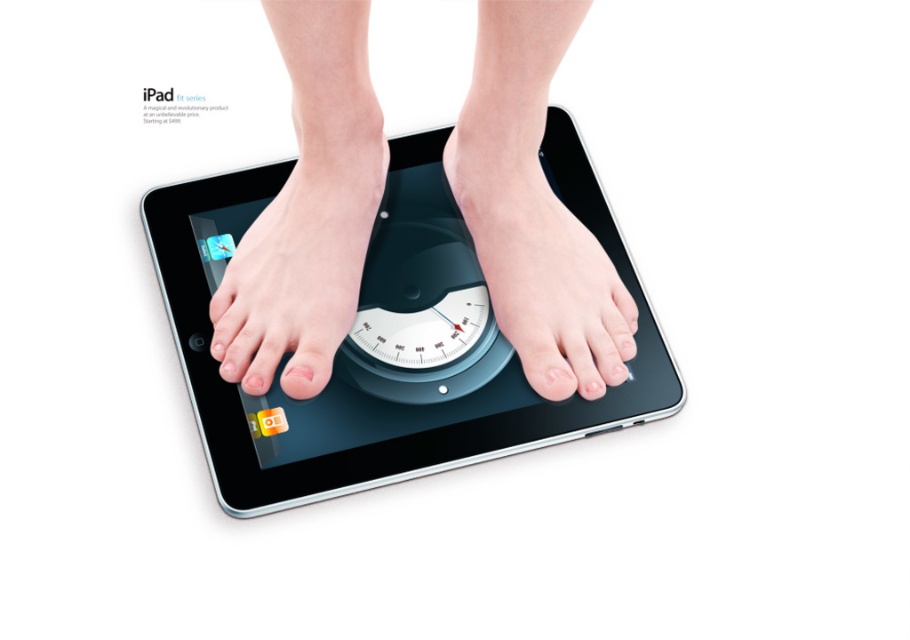
What do you see at coordinates (375, 358) in the screenshot?
I see `black glossy tablet at center` at bounding box center [375, 358].

Is point (638, 317) more distant than point (364, 232)?

Yes, it is.

This screenshot has width=910, height=640. Find the location of `black glossy tablet at center`. black glossy tablet at center is located at coordinates (375, 358).

Is point (514, 68) behind point (550, 285)?

No, it is not.

Who is taller, smooth skin feet at center or pale skin foot at center?

With more height is smooth skin feet at center.

The width and height of the screenshot is (910, 640). I want to click on smooth skin feet at center, so click(x=534, y=209).

The width and height of the screenshot is (910, 640). I want to click on smooth skin feet at center, so click(x=534, y=209).

Image resolution: width=910 pixels, height=640 pixels. Describe the element at coordinates (375, 358) in the screenshot. I see `black glossy tablet at center` at that location.

Is point (561, 113) in front of point (547, 362)?

That is False.

Find the location of `black glossy tablet at center`. black glossy tablet at center is located at coordinates click(375, 358).